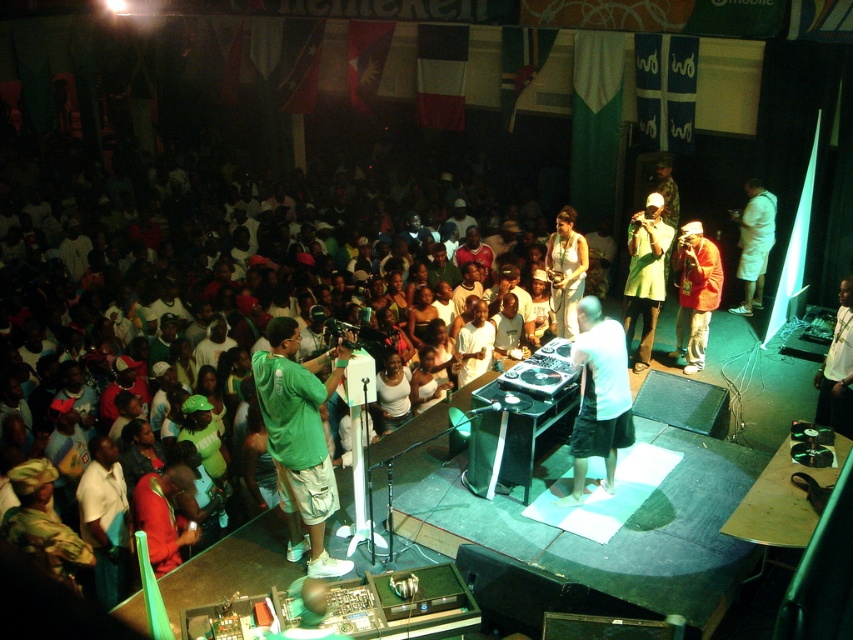
Is the position of green matte shirt at lower left less distant than that of white cotton shirt at right?

Yes, green matte shirt at lower left is in front of white cotton shirt at right.

Who is more distant from viewer, (286, 326) or (749, 253)?

The point (749, 253) is more distant.

Identify the location of green matte shirt at lower left. (299, 440).

Can you confirm if white cotton crowd at lower left is positioned below green matte shirt at lower left?

Incorrect, white cotton crowd at lower left is not positioned below green matte shirt at lower left.

Is white cotton crowd at lower left wider than green matte shirt at lower left?

Indeed, white cotton crowd at lower left has a greater width compared to green matte shirt at lower left.

Between point (160, 372) and point (343, 566), which one is positioned behind?

Positioned behind is point (160, 372).

The height and width of the screenshot is (640, 853). What are the coordinates of `white cotton crowd at lower left` in the screenshot? It's located at (157, 312).

Can you confirm if white cotton crowd at lower left is thinner than white cotton shirt at right?

No, white cotton crowd at lower left is not thinner than white cotton shirt at right.

Does white cotton crowd at lower left have a larger size compared to white cotton shirt at right?

Indeed, white cotton crowd at lower left has a larger size compared to white cotton shirt at right.

Locate an element on the screen. The image size is (853, 640). white cotton crowd at lower left is located at coordinates (157, 312).

Where is `white cotton crowd at lower left`? white cotton crowd at lower left is located at coordinates click(157, 312).